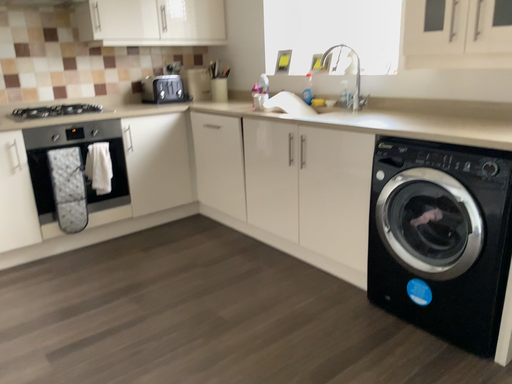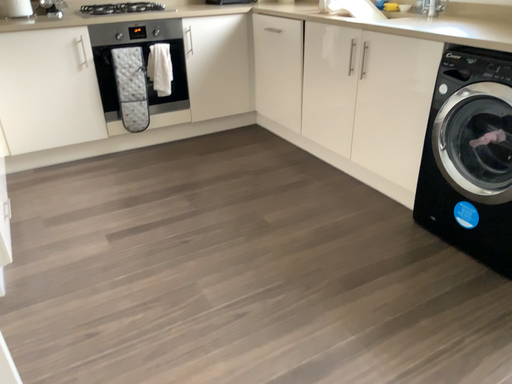
Question: How did the camera likely rotate when shooting the video?

Choices:
 (A) rotated right
 (B) rotated left

Answer: (B)